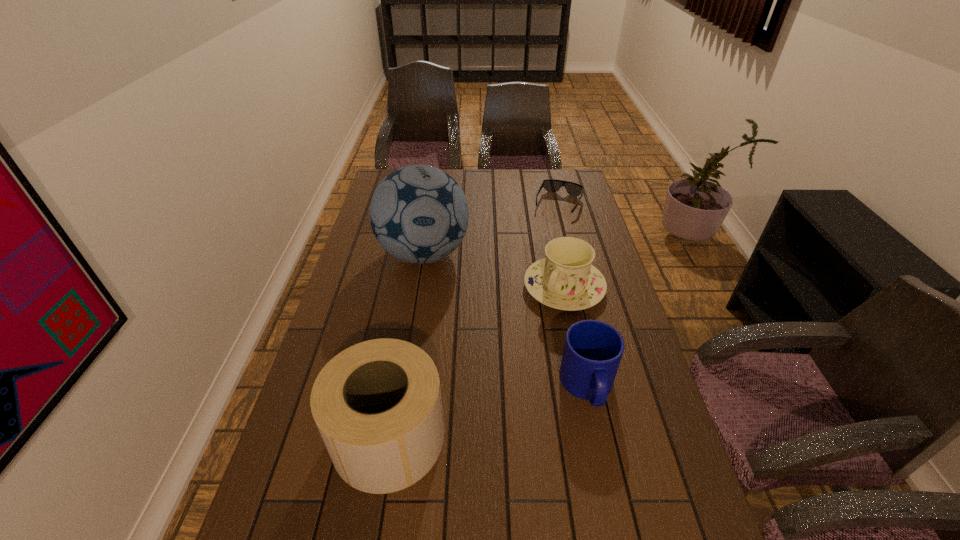
Locate an element on the screen. vacant area that lies between the tallest object and the chinaware is located at coordinates (493, 271).

At what (x,y) coordinates should I click in order to perform the action: click on free space that is in between the farthest object and the toilet tissue. Please return your answer as a coordinate pair (x, y). The height and width of the screenshot is (540, 960). Looking at the image, I should click on (474, 321).

Find the location of a particular element. This screenshot has height=540, width=960. vacant space that is in between the second tallest object and the shortest object is located at coordinates (474, 321).

In order to click on vacant space in between the mug and the second tallest object in this screenshot , I will do `click(489, 412)`.

Identify which object is located as the third nearest to the mug. Please provide its 2D coordinates. Your answer should be formatted as a tuple, i.e. [(x, y)], where the tuple contains the x and y coordinates of a point satisfying the conditions above.

[(419, 214)]

This screenshot has width=960, height=540. I want to click on object identified as the third closest to the tallest object, so click(592, 352).

Image resolution: width=960 pixels, height=540 pixels. I want to click on vacant area that satisfies the following two spatial constraints: 1. on the back side of the chinaware; 2. on the right side of the farthest object, so click(x=546, y=205).

I want to click on blank space that satisfies the following two spatial constraints: 1. on the back side of the shortest object; 2. on the left side of the tallest object, so click(x=431, y=205).

Where is `blank space that satisfies the following two spatial constraints: 1. on the back side of the soccer ball; 2. on the left side of the sunglasses`? The height and width of the screenshot is (540, 960). blank space that satisfies the following two spatial constraints: 1. on the back side of the soccer ball; 2. on the left side of the sunglasses is located at coordinates [x=431, y=205].

Where is `vacant space that satisfies the following two spatial constraints: 1. on the front side of the chinaware; 2. on the left side of the soccer ball`? This screenshot has height=540, width=960. vacant space that satisfies the following two spatial constraints: 1. on the front side of the chinaware; 2. on the left side of the soccer ball is located at coordinates (419, 287).